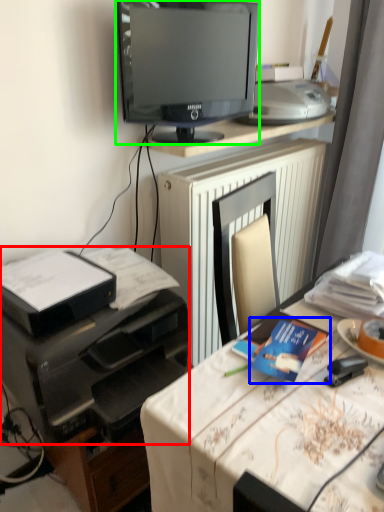
Question: Which is nearer to the printer (highlighted by a red box)? paperback book (highlighted by a blue box) or television (highlighted by a green box).

Choices:
 (A) paperback book
 (B) television

Answer: (A)